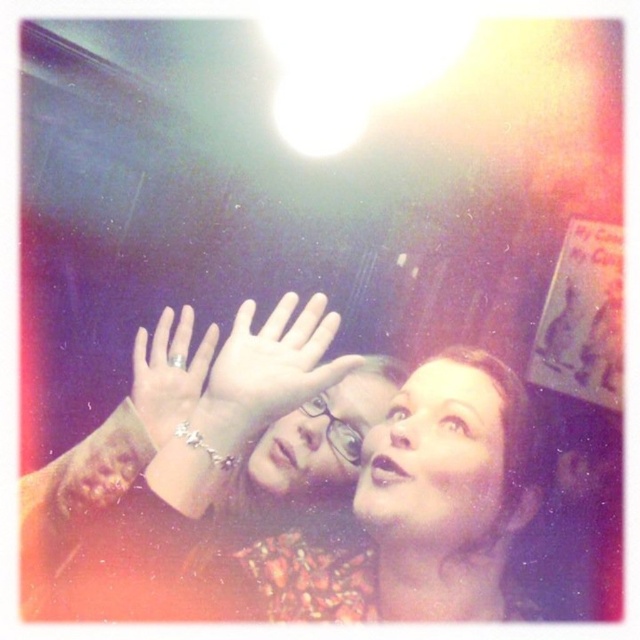
What do you see at coordinates (435, 460) in the screenshot? This screenshot has height=640, width=640. I see `smooth skin face at upper center` at bounding box center [435, 460].

Does smooth skin face at upper center have a greater height compared to silver metallic ring at upper center?

Yes.

In order to click on smooth skin face at upper center in this screenshot , I will do `click(435, 460)`.

Is point (292, 403) more distant than point (355, 387)?

No.

Who is lower down, matte skin hand at center or matte glass face at upper center?

matte glass face at upper center is lower down.

The height and width of the screenshot is (640, 640). Describe the element at coordinates (269, 368) in the screenshot. I see `matte skin hand at center` at that location.

This screenshot has width=640, height=640. I want to click on matte skin hand at center, so click(269, 368).

Based on the photo, is smooth skin face at upper center to the left of matte skin hand at center from the viewer's perspective?

In fact, smooth skin face at upper center is to the right of matte skin hand at center.

Where is `smooth skin face at upper center`? This screenshot has width=640, height=640. smooth skin face at upper center is located at coordinates (x=435, y=460).